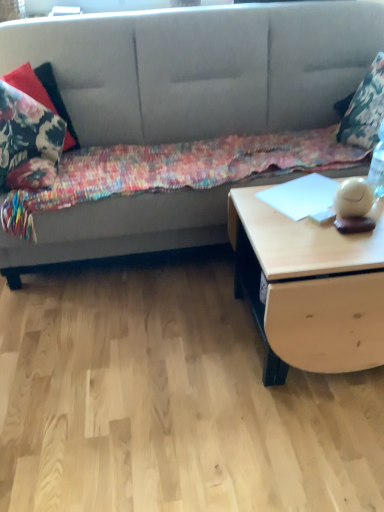
This screenshot has height=512, width=384. What are the coordinates of `floral fabric blanket at center` in the screenshot? It's located at (176, 169).

Image resolution: width=384 pixels, height=512 pixels. I want to click on floral fabric pillow at left, placed as the 1th pillow when sorted from left to right, so click(43, 94).

Describe the element at coordinates (309, 288) in the screenshot. This screenshot has width=384, height=512. I see `light wood/texture table at right` at that location.

Locate an element on the screen. This screenshot has height=512, width=384. floral fabric blanket at center is located at coordinates (176, 169).

From the image's perspective, which is below, textured gray couch at upper center or light wood/texture table at right?

From the image's view, light wood/texture table at right is below.

Looking at this image, which of these two, textured gray couch at upper center or light wood/texture table at right, is bigger?

Bigger between the two is textured gray couch at upper center.

Is textured gray couch at upper center spatially inside light wood/texture table at right, or outside of it?

textured gray couch at upper center is located beyond the bounds of light wood/texture table at right.

Is textured gray couch at upper center not close to light wood/texture table at right?

textured gray couch at upper center is actually quite close to light wood/texture table at right.

Is floral fabric pillow at left, placed as the 1th pillow when sorted from left to right, far from light wood/texture table at right?

floral fabric pillow at left, placed as the 1th pillow when sorted from left to right, is far away from light wood/texture table at right.

Between floral fabric pillow at left, placed as the 1th pillow when sorted from left to right, and light wood/texture table at right, which one has larger size?

Bigger between the two is light wood/texture table at right.

What's the angular difference between floral fabric pillow at left, placed as the 1th pillow when sorted from left to right, and light wood/texture table at right's facing directions?

The facing directions of floral fabric pillow at left, placed as the 1th pillow when sorted from left to right, and light wood/texture table at right are 29.2 degrees apart.

Between point (123, 151) and point (244, 212), which one is positioned behind?

The point (123, 151) is farther from the camera.

Is floral fabric blanket at center inside or outside of light wood/texture table at right?

floral fabric blanket at center is outside light wood/texture table at right.

Looking at their sizes, would you say floral fabric blanket at center is wider or thinner than light wood/texture table at right?

In the image, floral fabric blanket at center appears to be wider than light wood/texture table at right.

Is floral fabric blanket at center looking in the opposite direction of light wood/texture table at right?

No, light wood/texture table at right is not at the back of floral fabric blanket at center.

Is light wood/texture table at right shorter than floral fabric pillow at upper right, the 2th pillow positioned from the left?

Yes.

Locate an element on the screen. This screenshot has width=384, height=512. table located on the left of floral fabric pillow at upper right, placed as the 1th pillow when sorted from right to left is located at coordinates pos(309,288).

Are floral fabric pillow at upper right, the 2th pillow positioned from the left, and floral fabric blanket at center making contact?

No, floral fabric pillow at upper right, the 2th pillow positioned from the left, is not next to floral fabric blanket at center.

Based on the photo, from the image's perspective, which one is positioned higher, floral fabric pillow at upper right, the 2th pillow positioned from the left, or floral fabric blanket at center?

floral fabric pillow at upper right, the 2th pillow positioned from the left.

Which point is more forward, (x=380, y=52) or (x=131, y=193)?

The point (x=131, y=193) is in front.

How much distance is there between floral fabric pillow at upper right, placed as the 1th pillow when sorted from right to left, and floral fabric blanket at center?

floral fabric pillow at upper right, placed as the 1th pillow when sorted from right to left, and floral fabric blanket at center are 47.61 centimeters apart from each other.

Is textured gray couch at upper center next to floral fabric pillow at upper right, the 2th pillow positioned from the left?

textured gray couch at upper center and floral fabric pillow at upper right, the 2th pillow positioned from the left, are not in contact.

From the image's perspective, is textured gray couch at upper center below floral fabric pillow at upper right, the 2th pillow positioned from the left?

Yes.

Does point (358, 58) come behind point (354, 96)?

That is True.

From the image's perspective, would you say floral fabric pillow at upper right, the 2th pillow positioned from the left, is shown under floral fabric pillow at left, the second pillow positioned from the right?

No, from the image's perspective, floral fabric pillow at upper right, the 2th pillow positioned from the left, is not below floral fabric pillow at left, the second pillow positioned from the right.

Which object is wider, floral fabric pillow at upper right, placed as the 1th pillow when sorted from right to left, or floral fabric pillow at left, placed as the 1th pillow when sorted from left to right?

With larger width is floral fabric pillow at left, placed as the 1th pillow when sorted from left to right.

Is floral fabric pillow at upper right, placed as the 1th pillow when sorted from right to left, not close to floral fabric pillow at left, placed as the 1th pillow when sorted from left to right?

floral fabric pillow at upper right, placed as the 1th pillow when sorted from right to left, is positioned a significant distance from floral fabric pillow at left, placed as the 1th pillow when sorted from left to right.

Is floral fabric pillow at upper right, placed as the 1th pillow when sorted from right to left, completely or partially outside of floral fabric pillow at left, placed as the 1th pillow when sorted from left to right?

Yes.

I want to click on table below the textured gray couch at upper center (from a real-world perspective), so click(x=309, y=288).

There is a light wood/texture table at right. Where is `the 1st pillow above it (from the image's perspective)`? This screenshot has width=384, height=512. the 1st pillow above it (from the image's perspective) is located at coordinates (43, 94).

Estimate the real-world distances between objects in this image. Which object is further from textured gray couch at upper center, floral fabric pillow at upper right, placed as the 1th pillow when sorted from right to left, or floral fabric pillow at left, placed as the 1th pillow when sorted from left to right?

floral fabric pillow at upper right, placed as the 1th pillow when sorted from right to left, lies further to textured gray couch at upper center than the other object.

Based on their spatial positions, is floral fabric pillow at left, placed as the 1th pillow when sorted from left to right, or light wood/texture table at right closer to textured gray couch at upper center?

floral fabric pillow at left, placed as the 1th pillow when sorted from left to right, is positioned closer to the anchor textured gray couch at upper center.

Considering their positions, is floral fabric blanket at center positioned further to floral fabric pillow at upper right, placed as the 1th pillow when sorted from right to left, than light wood/texture table at right?

light wood/texture table at right is positioned further to the anchor floral fabric pillow at upper right, placed as the 1th pillow when sorted from right to left.

Consider the image. Which object lies nearer to the anchor point floral fabric pillow at left, placed as the 1th pillow when sorted from left to right, floral fabric blanket at center or textured gray couch at upper center?

textured gray couch at upper center is closer to floral fabric pillow at left, placed as the 1th pillow when sorted from left to right.

Consider the image. Looking at the image, which one is located further to floral fabric pillow at upper right, the 2th pillow positioned from the left, light wood/texture table at right or floral fabric blanket at center?

The object further to floral fabric pillow at upper right, the 2th pillow positioned from the left, is light wood/texture table at right.

Based on their spatial positions, is floral fabric pillow at upper right, placed as the 1th pillow when sorted from right to left, or textured gray couch at upper center closer to light wood/texture table at right?

The object closer to light wood/texture table at right is floral fabric pillow at upper right, placed as the 1th pillow when sorted from right to left.

Which object lies nearer to the anchor point floral fabric blanket at center, textured gray couch at upper center or light wood/texture table at right?

The object closer to floral fabric blanket at center is textured gray couch at upper center.

Based on their spatial positions, is floral fabric blanket at center or textured gray couch at upper center further from light wood/texture table at right?

The object further to light wood/texture table at right is textured gray couch at upper center.

I want to click on studio couch that lies between floral fabric pillow at upper right, placed as the 1th pillow when sorted from right to left, and light wood/texture table at right from top to bottom, so click(202, 68).

I want to click on blanket between floral fabric pillow at upper right, the 2th pillow positioned from the left, and light wood/texture table at right in the up-down direction, so click(176, 169).

The height and width of the screenshot is (512, 384). Find the location of `studio couch situated between floral fabric pillow at left, the second pillow positioned from the right, and light wood/texture table at right from left to right`. studio couch situated between floral fabric pillow at left, the second pillow positioned from the right, and light wood/texture table at right from left to right is located at coordinates (202, 68).

Find the location of a particular element. blanket between floral fabric pillow at left, the second pillow positioned from the right, and textured gray couch at upper center is located at coordinates (176, 169).